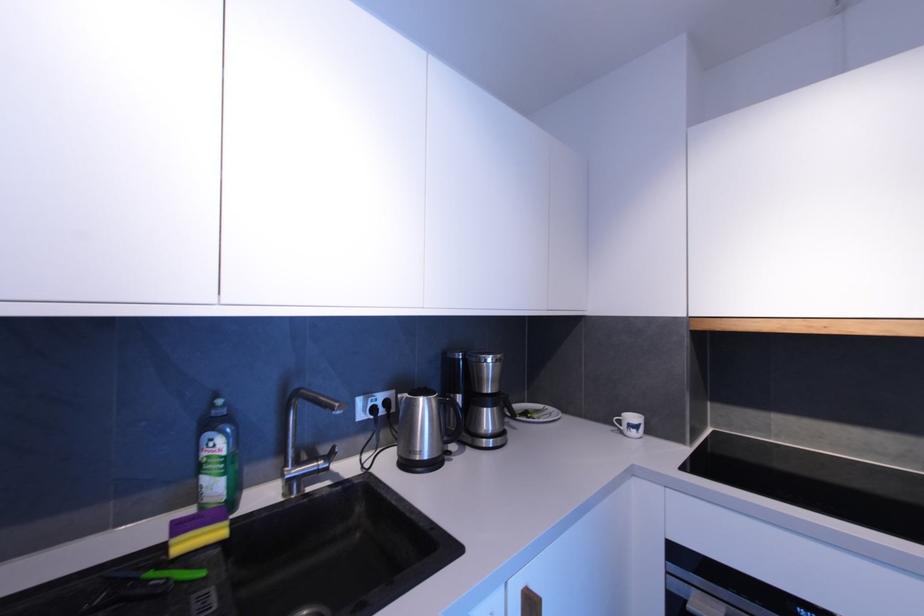
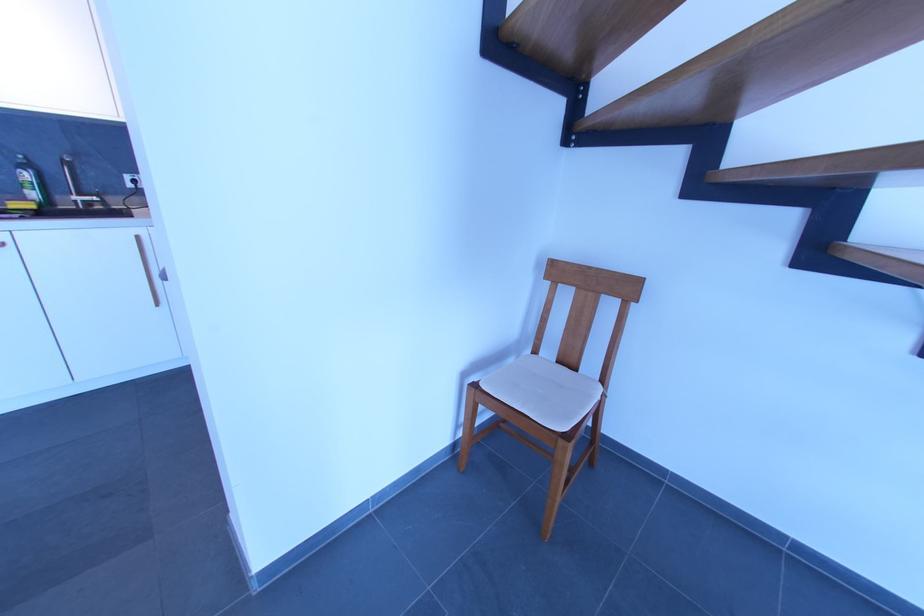
In the second image, find the point that corresponds to pixel 208 456 in the first image.

(26, 182)